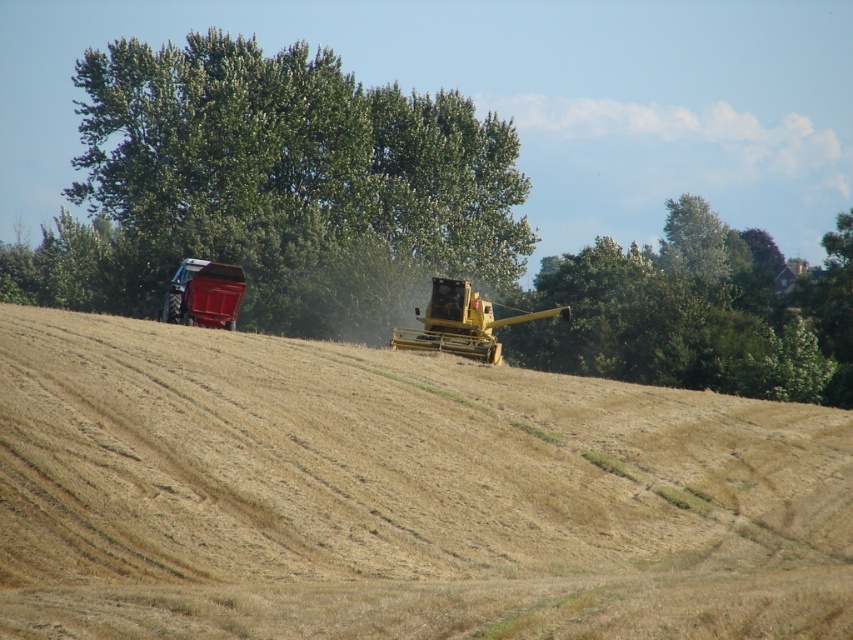
Question: Is dry straw field at center to the left of green leafy tree at upper center from the viewer's perspective?

Choices:
 (A) no
 (B) yes

Answer: (A)

Question: Estimate the real-world distances between objects in this image. Which object is closer to the dry straw field at center?

Choices:
 (A) green leafy tree at center
 (B) yellow metallic combine at center
 (C) metallic red tractor at left
 (D) green leafy tree at upper center

Answer: (C)

Question: Is green leafy tree at upper center to the left of yellow metallic combine at center from the viewer's perspective?

Choices:
 (A) yes
 (B) no

Answer: (A)

Question: Which is nearer to the green leafy tree at center?

Choices:
 (A) metallic red tractor at left
 (B) yellow metallic combine at center
 (C) green leafy tree at upper center
 (D) dry straw field at center

Answer: (C)

Question: Does yellow metallic combine at center appear under metallic red tractor at left?

Choices:
 (A) no
 (B) yes

Answer: (B)

Question: Which of the following is the farthest from the observer?

Choices:
 (A) green leafy tree at center
 (B) metallic red tractor at left

Answer: (A)